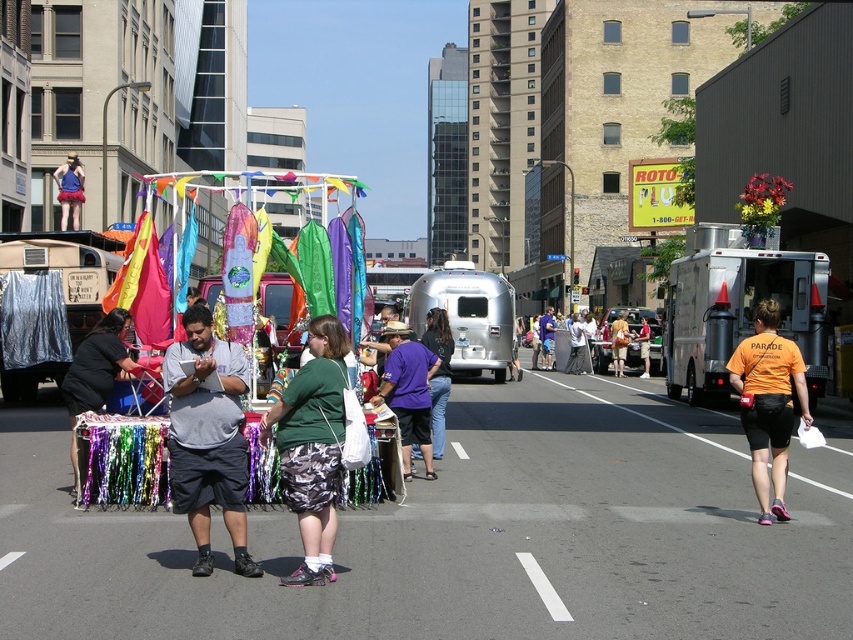
You are organizing a street event and need to place a large banner between the gray fabric stall at center and the silver metallic trailer at center. Which object should the banner be placed closer to if you want it to be more noticeable to people approaching from the front?

The banner should be placed closer to the silver metallic trailer at center because it is larger than the gray fabric stall at center, making it a more prominent focal point for approaching attendees.